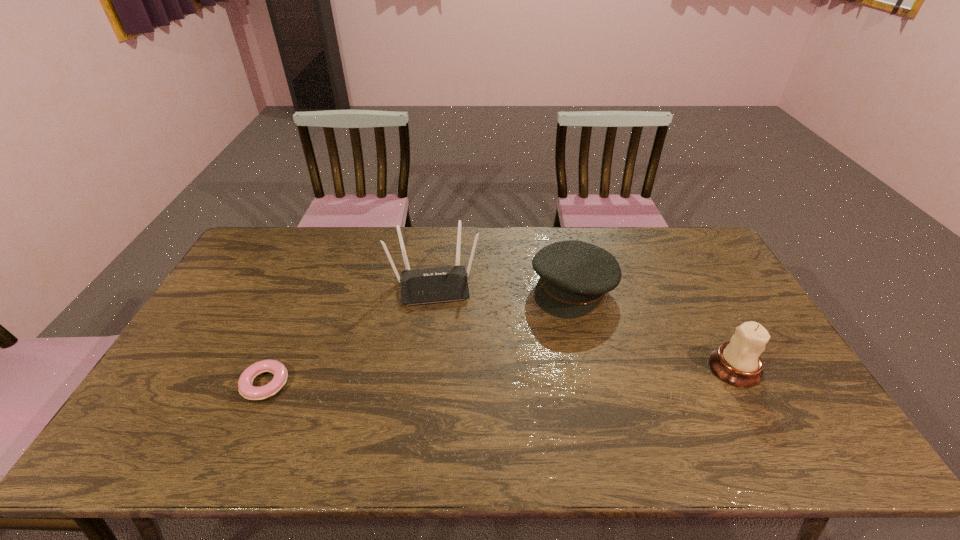
You are a GUI agent. You are given a task and a screenshot of the screen. Output one action in this format:
    pyautogui.click(x=<x>, y=<y>)
    Task: Click on the vacant space on the desktop that is between the leftmost object and the rightmost object and is positioned on the front-facing side of the beret
    The width and height of the screenshot is (960, 540).
    Given the screenshot: What is the action you would take?
    pyautogui.click(x=494, y=376)

Identify the location of vacant spot on the desktop that is between the shortest object and the rightmost object and is positioned on the front-facing side of the router. The width and height of the screenshot is (960, 540). (443, 378).